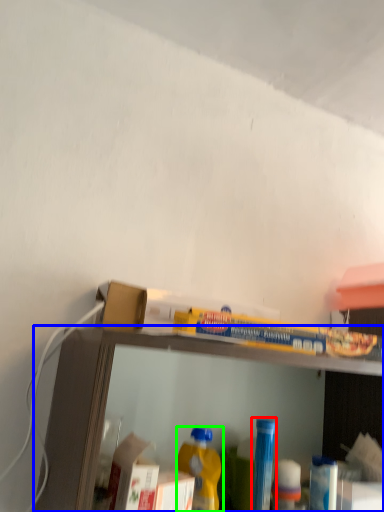
Question: Estimate the real-world distances between objects in this image. Which object is closer to bottle (highlighted by a red box), shelf (highlighted by a blue box) or bottle (highlighted by a green box)?

Choices:
 (A) shelf
 (B) bottle

Answer: (B)